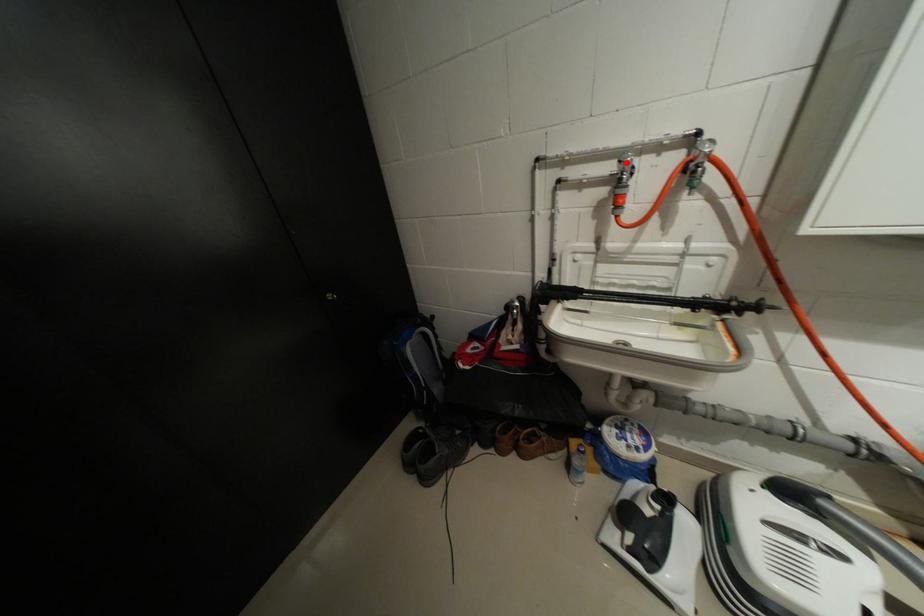
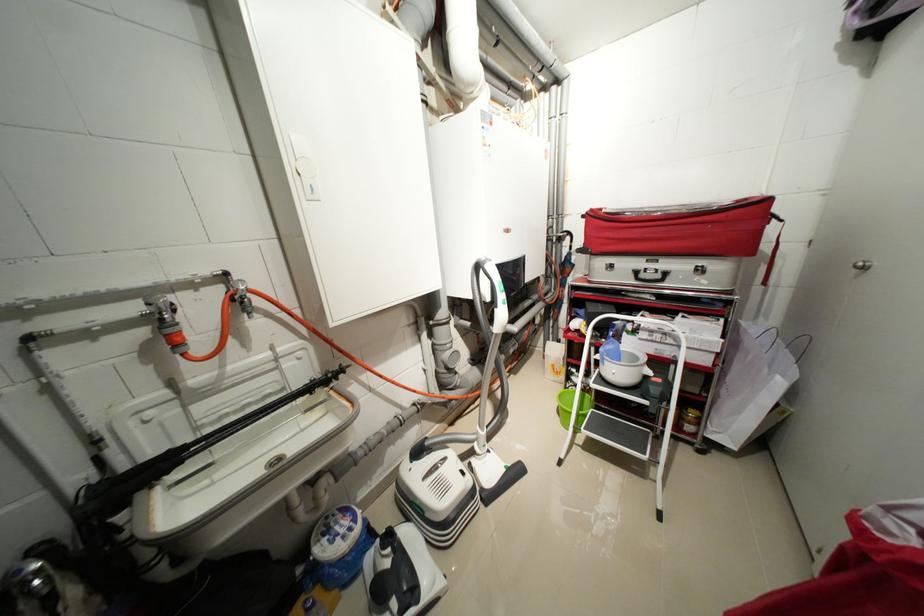
The point at the highlighted location is marked in the first image. Where is the corresponding point in the second image?

(155, 305)